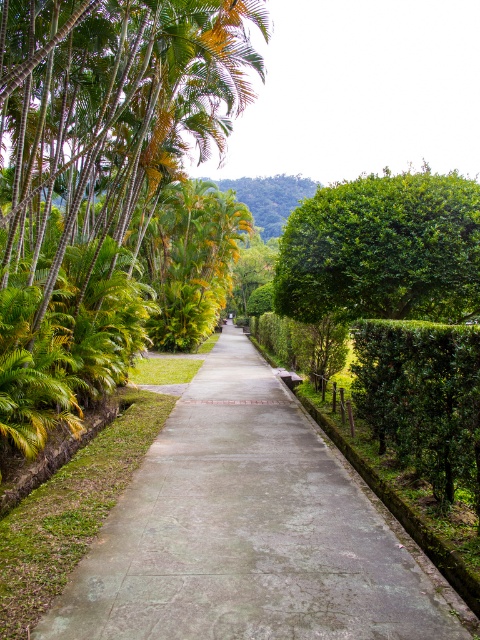
You are a gardener standing at the start of the pathway. You need to trim the green leafy hedge at right. Which direction should you move to reach it from the green concrete pavement at center?

Result: The green leafy hedge at right is located to the right of the green concrete pavement at center, so you should move to your right to reach it.

You are standing at the entrance of the pathway and want to reach the green concrete pavement at center. According to the coordinates provided, what are the exact coordinates where you should aim to step on to reach your destination?

The green concrete pavement at center is located at coordinates point (244, 531), so you should aim to step on that exact point to reach your destination.